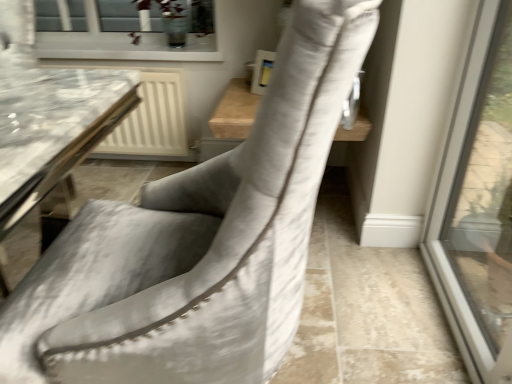
The width and height of the screenshot is (512, 384). What are the coordinates of `suede-like gray chair at center` in the screenshot? It's located at (198, 242).

What do you see at coordinates (198, 242) in the screenshot? I see `suede-like gray chair at center` at bounding box center [198, 242].

The height and width of the screenshot is (384, 512). What do you see at coordinates (165, 19) in the screenshot? I see `green leafy plant at upper center` at bounding box center [165, 19].

Measure the distance between green leafy plant at upper center and camera.

green leafy plant at upper center is 6.43 feet away from camera.

Where is `green leafy plant at upper center`? This screenshot has width=512, height=384. green leafy plant at upper center is located at coordinates (165, 19).

You are a GUI agent. You are given a task and a screenshot of the screen. Output one action in this format:
    pyautogui.click(x=<x>, y=<y>)
    Task: Click on the suede-like gray chair at center
    This screenshot has height=384, width=512.
    Given the screenshot: What is the action you would take?
    pyautogui.click(x=198, y=242)

In the image, is suede-like gray chair at center on the left side or the right side of green leafy plant at upper center?

suede-like gray chair at center is to the right of green leafy plant at upper center.

Is suede-like gray chair at center further to the viewer compared to green leafy plant at upper center?

No, the depth of suede-like gray chair at center is less than that of green leafy plant at upper center.

Does point (274, 288) lie behind point (175, 28)?

No.

From the image's perspective, between suede-like gray chair at center and green leafy plant at upper center, which one is located above?

green leafy plant at upper center, from the image's perspective.

From a real-world perspective, is suede-like gray chair at center positioned over green leafy plant at upper center based on gravity?

No, from a real-world perspective, suede-like gray chair at center is not on top of green leafy plant at upper center.

In terms of width, does suede-like gray chair at center look wider or thinner when compared to green leafy plant at upper center?

In the image, suede-like gray chair at center appears to be wider than green leafy plant at upper center.

Does suede-like gray chair at center have a lesser height compared to green leafy plant at upper center?

No, suede-like gray chair at center is not shorter than green leafy plant at upper center.

Who is bigger, suede-like gray chair at center or green leafy plant at upper center?

suede-like gray chair at center.

Is suede-like gray chair at center inside the boundaries of green leafy plant at upper center, or outside?

suede-like gray chair at center is outside green leafy plant at upper center.

Would you say suede-like gray chair at center is a long distance from green leafy plant at upper center?

That's right, there is a large distance between suede-like gray chair at center and green leafy plant at upper center.

Based on the photo, is suede-like gray chair at center looking in the opposite direction of green leafy plant at upper center?

No, suede-like gray chair at center is not facing the opposite direction of green leafy plant at upper center.

What's the angular difference between suede-like gray chair at center and green leafy plant at upper center's facing directions?

The angular difference between suede-like gray chair at center and green leafy plant at upper center is 90 degrees.

Locate an element on the screen. The image size is (512, 384). plant above the suede-like gray chair at center (from a real-world perspective) is located at coordinates coord(165,19).

Which object is positioned more to the left, green leafy plant at upper center or suede-like gray chair at center?

From the viewer's perspective, green leafy plant at upper center appears more on the left side.

Relative to suede-like gray chair at center, is green leafy plant at upper center in front or behind?

In the image, green leafy plant at upper center appears behind suede-like gray chair at center.

Between point (179, 26) and point (199, 258), which one is positioned behind?

Positioned behind is point (179, 26).

From the image's perspective, who appears lower, green leafy plant at upper center or suede-like gray chair at center?

suede-like gray chair at center is shown below in the image.

From a real-world perspective, is green leafy plant at upper center below suede-like gray chair at center?

Actually, green leafy plant at upper center is physically above suede-like gray chair at center in the real world.

Consider the image. Which object is wider, green leafy plant at upper center or suede-like gray chair at center?

Wider between the two is suede-like gray chair at center.

Looking at this image, is green leafy plant at upper center taller or shorter than suede-like gray chair at center?

Clearly, green leafy plant at upper center is shorter compared to suede-like gray chair at center.

Considering the sizes of green leafy plant at upper center and suede-like gray chair at center in the image, is green leafy plant at upper center bigger or smaller than suede-like gray chair at center?

Clearly, green leafy plant at upper center is smaller in size than suede-like gray chair at center.

Would you say green leafy plant at upper center is inside or outside suede-like gray chair at center?

green leafy plant at upper center is not enclosed by suede-like gray chair at center.

Are green leafy plant at upper center and suede-like gray chair at center making contact?

green leafy plant at upper center and suede-like gray chair at center are not in contact.

Is green leafy plant at upper center oriented towards suede-like gray chair at center?

Yes, green leafy plant at upper center faces towards suede-like gray chair at center.

Based on the photo, how different are the orientations of green leafy plant at upper center and suede-like gray chair at center in degrees?

There is a 90-degree angle between the facing directions of green leafy plant at upper center and suede-like gray chair at center.

Where is `chair in front of the green leafy plant at upper center`? chair in front of the green leafy plant at upper center is located at coordinates (198, 242).

Find the location of a particular element. This screenshot has height=384, width=512. chair below the green leafy plant at upper center (from the image's perspective) is located at coordinates (198, 242).

This screenshot has width=512, height=384. What are the coordinates of `plant behind the suede-like gray chair at center` in the screenshot? It's located at (165, 19).